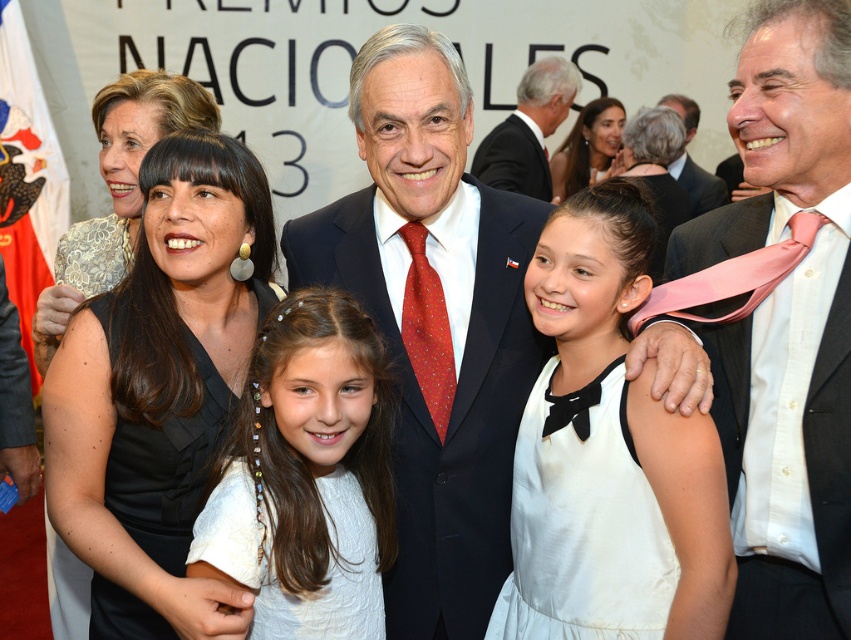
Question: Is pink silk tie at center below pink satin tie at center?

Choices:
 (A) yes
 (B) no

Answer: (A)

Question: Which object is positioned farthest from the pink satin tie at center?

Choices:
 (A) pink silk tie at center
 (B) white satin dress at center
 (C) pink silk tie at upper right

Answer: (C)

Question: Which of these objects is positioned closest to the dark suit at center?

Choices:
 (A) white textured dress at center
 (B) matte black dress at upper center
 (C) pink silk tie at upper right

Answer: (B)

Question: Which object is positioned closest to the white textured dress at center?

Choices:
 (A) black matte dress at center
 (B) pink silk tie at upper right
 (C) matte black dress at upper center

Answer: (A)

Question: Is dark suit at center positioned in front of red silk tie at center?

Choices:
 (A) no
 (B) yes

Answer: (A)

Question: Does white satin dress at center appear under pink silk tie at upper right?

Choices:
 (A) no
 (B) yes

Answer: (B)